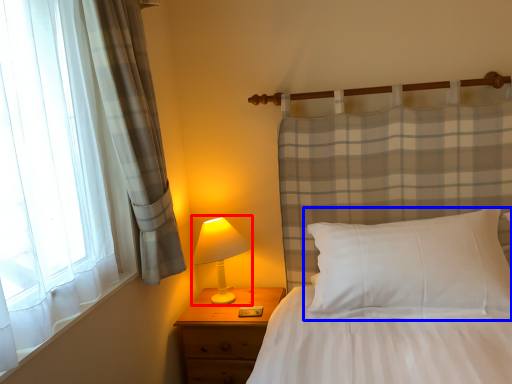
Question: Among these objects, which one is nearest to the camera, table lamp (highlighted by a red box) or pillow (highlighted by a blue box)?

Choices:
 (A) table lamp
 (B) pillow

Answer: (B)